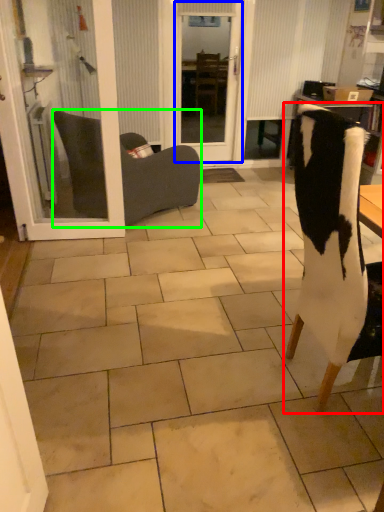
Question: Based on their relative distances, which object is farther from chair (highlighted by a red box)? Choose from screen door (highlighted by a blue box) and chair (highlighted by a green box).

Choices:
 (A) screen door
 (B) chair

Answer: (A)